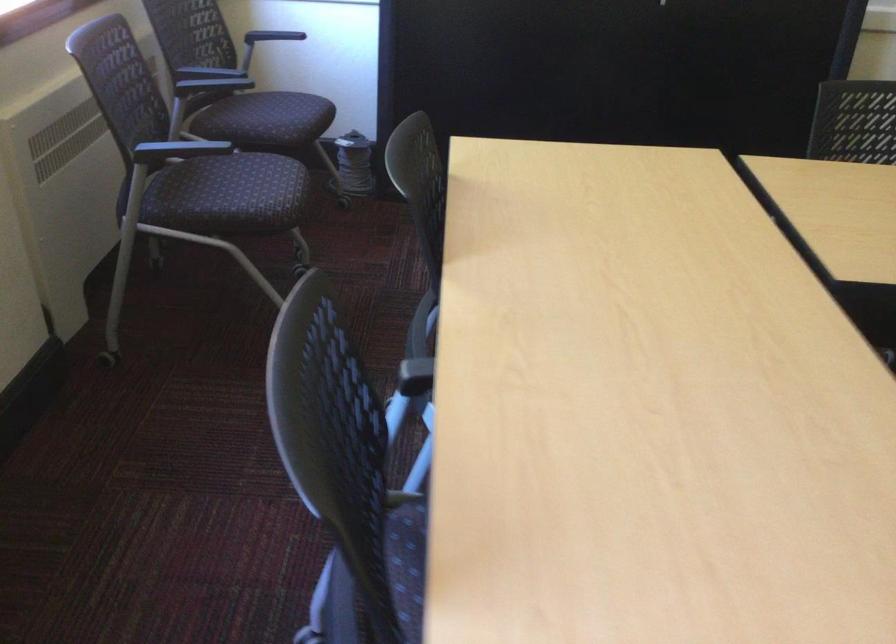
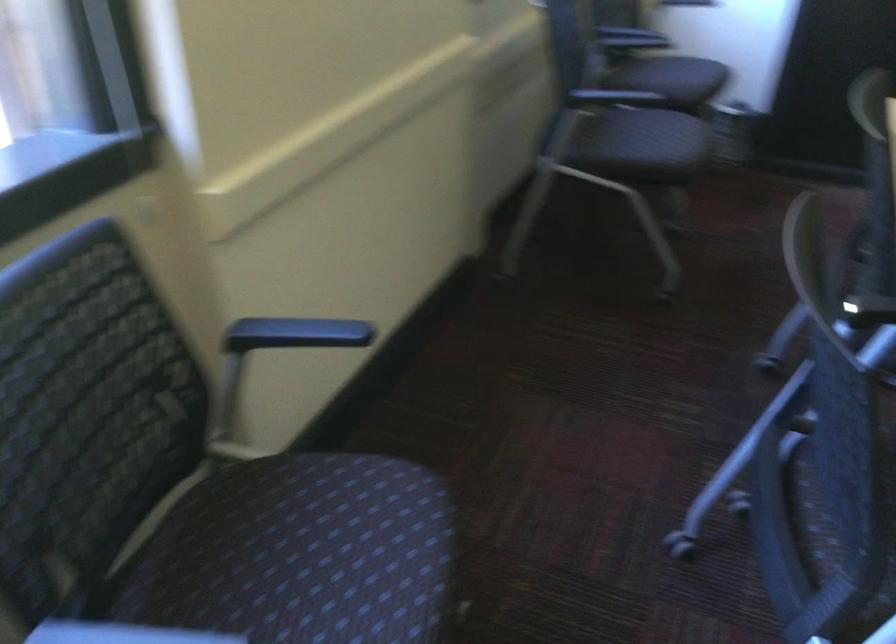
Question: The first image is from the beginning of the video and the second image is from the end. How did the camera likely rotate when shooting the video?

Choices:
 (A) Left
 (B) Right
 (C) Up
 (D) Down

Answer: (A)